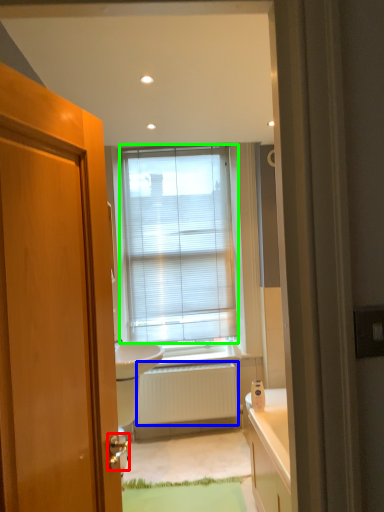
Question: Based on their relative distances, which object is nearer to door handle (highlighted by a red box)? Choose from radiator (highlighted by a blue box) and window blind (highlighted by a green box).

Choices:
 (A) radiator
 (B) window blind

Answer: (A)